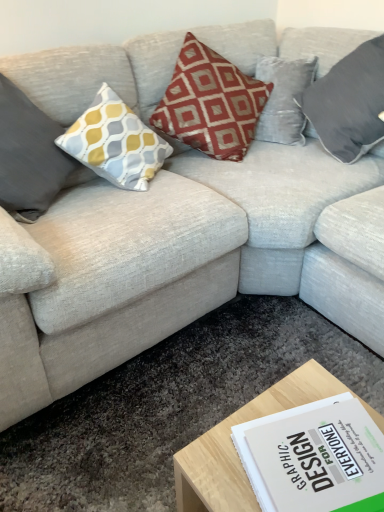
Question: Is velvet gray pillow at upper right, which appears as the 1th pillow when viewed from the right, far from yellow-grey patterned cushion at left, the 1th pillow viewed from the left?

Choices:
 (A) no
 (B) yes

Answer: (B)

Question: From a real-world perspective, is velvet gray pillow at upper right, positioned as the 3th pillow in left-to-right order, over yellow-grey patterned cushion at left, placed as the third pillow when sorted from right to left?

Choices:
 (A) no
 (B) yes

Answer: (B)

Question: Is velvet gray pillow at upper right, which appears as the 1th pillow when viewed from the right, next to yellow-grey patterned cushion at left, placed as the third pillow when sorted from right to left?

Choices:
 (A) yes
 (B) no

Answer: (B)

Question: From the image's perspective, does velvet gray pillow at upper right, which appears as the 1th pillow when viewed from the right, appear higher than yellow-grey patterned cushion at left, the 1th pillow viewed from the left?

Choices:
 (A) no
 (B) yes

Answer: (B)

Question: Is velvet gray pillow at upper right, positioned as the 3th pillow in left-to-right order, facing towards yellow-grey patterned cushion at left, the 1th pillow viewed from the left?

Choices:
 (A) no
 (B) yes

Answer: (B)

Question: Is light wood coffee table at lower center taller or shorter than red velvet cushion at center, positioned as the second pillow in right-to-left order?

Choices:
 (A) short
 (B) tall

Answer: (A)

Question: Considering the relative positions of light wood coffee table at lower center and red velvet cushion at center, the second pillow positioned from the left, in the image provided, is light wood coffee table at lower center to the left or to the right of red velvet cushion at center, the second pillow positioned from the left,?

Choices:
 (A) left
 (B) right

Answer: (B)

Question: Considering the positions of point (345, 391) and point (261, 89), is point (345, 391) closer or farther from the camera than point (261, 89)?

Choices:
 (A) farther
 (B) closer

Answer: (B)

Question: From the image's perspective, relative to red velvet cushion at center, positioned as the second pillow in right-to-left order, is light wood coffee table at lower center above or below?

Choices:
 (A) below
 (B) above

Answer: (A)

Question: Is point (322, 376) closer or farther from the camera than point (56, 155)?

Choices:
 (A) closer
 (B) farther

Answer: (A)

Question: Is light wood coffee table at lower center bigger or smaller than yellow-grey patterned cushion at left, the 1th pillow viewed from the left?

Choices:
 (A) small
 (B) big

Answer: (A)

Question: In the image, is light wood coffee table at lower center positioned in front of or behind yellow-grey patterned cushion at left, placed as the third pillow when sorted from right to left?

Choices:
 (A) behind
 (B) front

Answer: (B)

Question: From a real-world perspective, is light wood coffee table at lower center above or below yellow-grey patterned cushion at left, the 1th pillow viewed from the left?

Choices:
 (A) above
 (B) below

Answer: (B)

Question: Does point (21, 139) appear closer or farther from the camera than point (288, 390)?

Choices:
 (A) closer
 (B) farther

Answer: (B)

Question: Looking at the image, does yellow-grey patterned cushion at left, placed as the third pillow when sorted from right to left, seem bigger or smaller compared to light wood coffee table at lower center?

Choices:
 (A) big
 (B) small

Answer: (A)